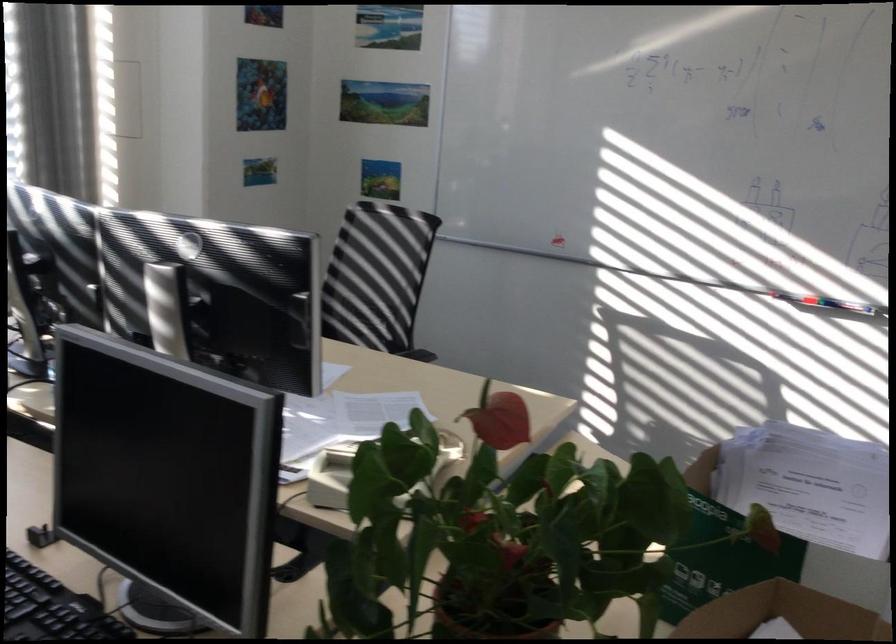
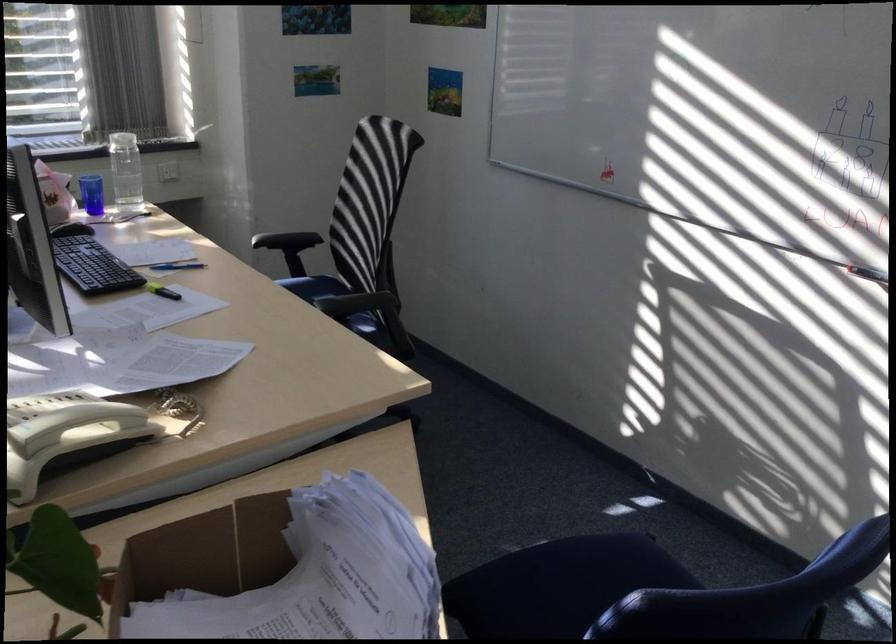
In a continuous first-person perspective shot, in which direction is the camera moving?

The cameraman moved toward right, forward.